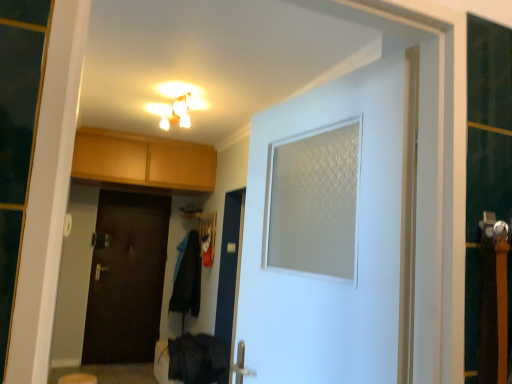
Question: From a real-world perspective, is dark fabric laundry at lower center, the 2th laundry from the top, physically located above or below matte white light fixture at upper center?

Choices:
 (A) above
 (B) below

Answer: (B)

Question: Would you say dark fabric laundry at lower center, which is counted as the 1th laundry, starting from the front, is inside or outside matte white light fixture at upper center?

Choices:
 (A) inside
 (B) outside

Answer: (B)

Question: Based on their relative distances, which object is nearer to the black fabric coat at center, the 2th laundry positioned from the front?

Choices:
 (A) white frosted glass door at center, which is the 2th door from left to right
 (B) light brown wood cabinets at upper left
 (C) dark fabric laundry at lower center, the 2th laundry from the top
 (D) dark wood door at center, arranged as the second door when viewed from the front
 (E) beige fabric step stool at lower left

Answer: (D)

Question: Which of these objects is positioned closest to the dark fabric laundry at lower center, the 2th laundry from the top?

Choices:
 (A) black fabric coat at center, the 1th laundry positioned from the back
 (B) beige fabric step stool at lower left
 (C) white frosted glass door at center, the 1th door when ordered from front to back
 (D) dark wood door at center, which appears as the second door when viewed from the right
 (E) light brown wood cabinets at upper left

Answer: (A)